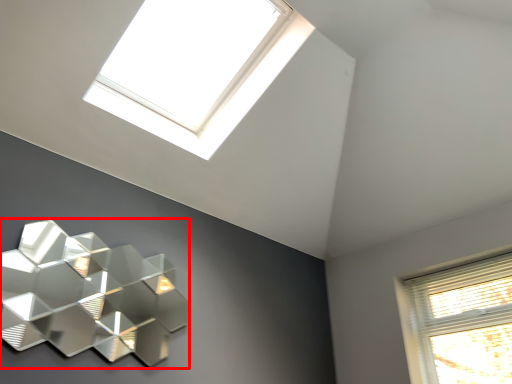
Question: Where is lamp (annotated by the red box) located in relation to window in the image?

Choices:
 (A) right
 (B) left

Answer: (B)